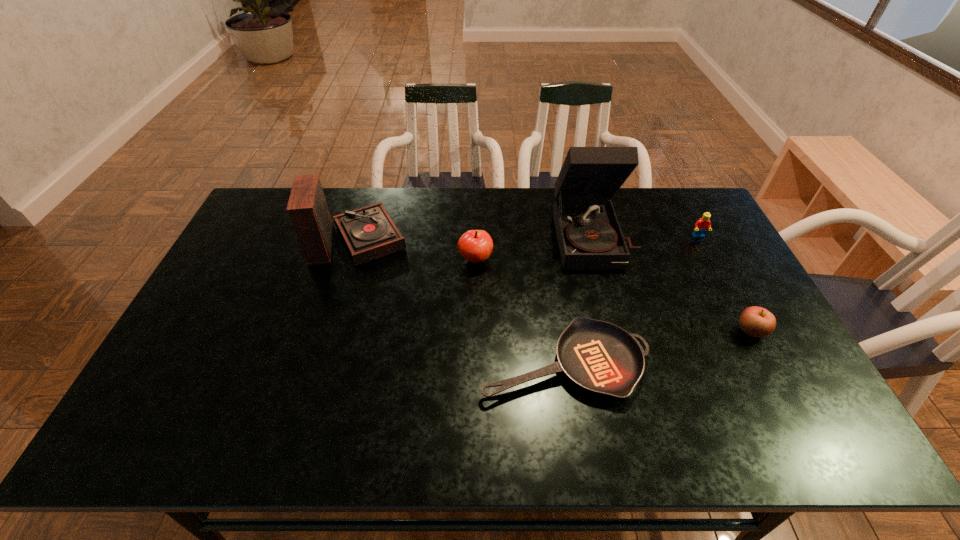
I want to click on the tallest object, so click(589, 235).

This screenshot has width=960, height=540. Identify the location of the right phonograph record. (589, 235).

Identify the location of the fifth shortest object. The width and height of the screenshot is (960, 540). (369, 233).

Locate an element on the screen. the leftmost object is located at coordinates (369, 233).

At what (x,y) coordinates should I click in order to perform the action: click on the third tallest object. Please return your answer as a coordinate pair (x, y). The image size is (960, 540). Looking at the image, I should click on (475, 246).

You are a GUI agent. You are given a task and a screenshot of the screen. Output one action in this format:
    pyautogui.click(x=<x>, y=<y>)
    Task: Click on the left apple
    
    Given the screenshot: What is the action you would take?
    pyautogui.click(x=475, y=246)

Find the location of a particular element. The height and width of the screenshot is (540, 960). Lego is located at coordinates (701, 226).

The width and height of the screenshot is (960, 540). Find the location of `the nearer apple`. the nearer apple is located at coordinates (755, 321).

The image size is (960, 540). I want to click on the shorter apple, so click(755, 321).

This screenshot has width=960, height=540. I want to click on the shortest object, so click(602, 358).